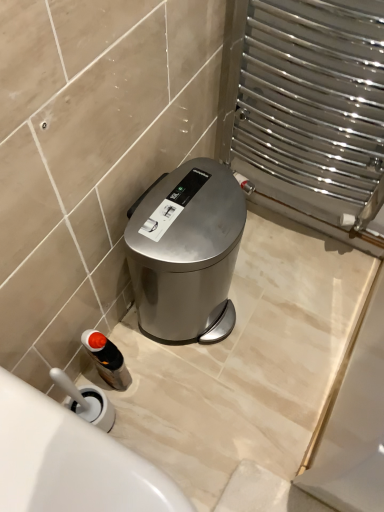
You are a GUI agent. You are given a task and a screenshot of the screen. Output one action in this format:
    pyautogui.click(x=<x>, y=<y>)
    Task: Click on the free location above satin silver trash can at center (from a real-world perspective)
    The image size is (384, 512).
    Given the screenshot: What is the action you would take?
    pyautogui.click(x=183, y=208)